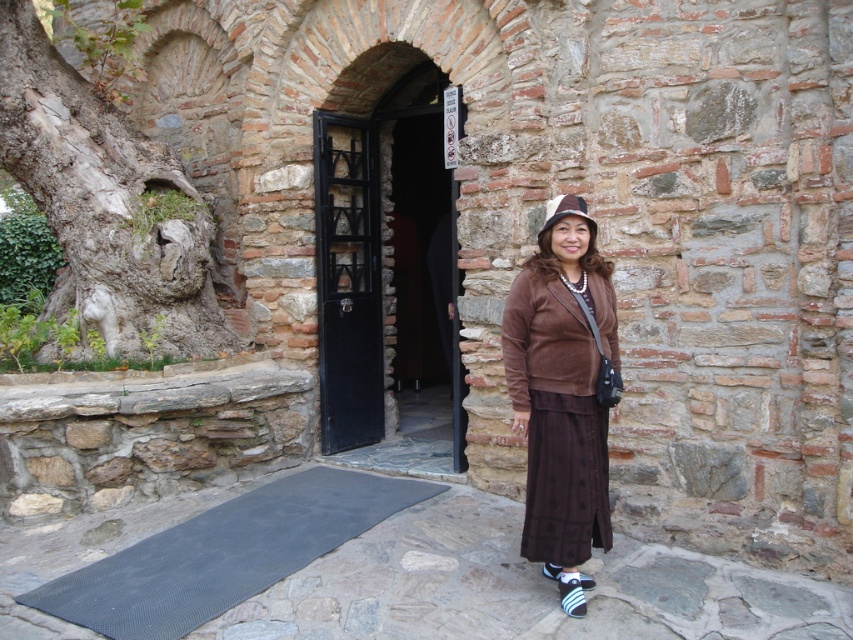
Does black rubber mat at lower center have a lesser height compared to black wooden door at center?

Yes.

Who is more distant from viewer, (260, 525) or (341, 180)?

Point (341, 180)

You are a GUI agent. You are given a task and a screenshot of the screen. Output one action in this format:
    pyautogui.click(x=<x>, y=<y>)
    Task: Click on the black rubber mat at lower center
    This screenshot has width=853, height=640.
    Given the screenshot: What is the action you would take?
    pyautogui.click(x=223, y=554)

Between point (326, 289) and point (209, 300), which one is positioned in front?

Point (326, 289) is in front.

Can you confirm if black metal door at center is smaller than gray rough bark tree at left?

Indeed, black metal door at center has a smaller size compared to gray rough bark tree at left.

Who is more distant from viewer, (352, 148) or (78, 248)?

The point (352, 148) is behind.

At what (x,y) coordinates should I click in order to perform the action: click on black metal door at center. Please return your answer as a coordinate pair (x, y). Image resolution: width=853 pixels, height=640 pixels. Looking at the image, I should click on (386, 260).

Can you confirm if gray rough bark tree at left is taller than brown felt hat at center?

Yes, gray rough bark tree at left is taller than brown felt hat at center.

Who is positioned more to the right, gray rough bark tree at left or brown felt hat at center?

brown felt hat at center is more to the right.

Who is more forward, (105, 156) or (595, 234)?

Point (595, 234)

Where is `gray rough bark tree at left`? gray rough bark tree at left is located at coordinates (106, 202).